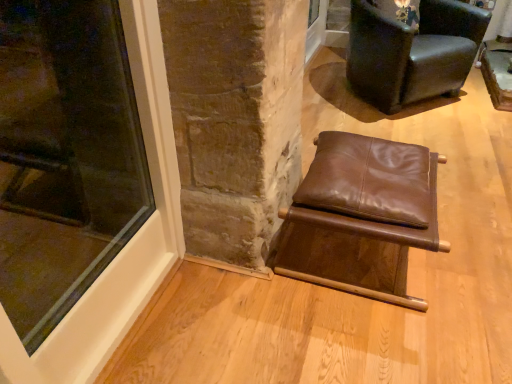
Question: Is transparent glass window at lower left not inside dark brown leather chair at upper right, placed as the first chair when sorted from back to front?

Choices:
 (A) no
 (B) yes

Answer: (B)

Question: Does transparent glass window at lower left appear on the right side of dark brown leather chair at upper right, placed as the first chair when sorted from back to front?

Choices:
 (A) yes
 (B) no

Answer: (B)

Question: Can you confirm if transparent glass window at lower left is wider than dark brown leather chair at upper right, positioned as the 2th chair in front-to-back order?

Choices:
 (A) yes
 (B) no

Answer: (B)

Question: From a real-world perspective, is transparent glass window at lower left physically above dark brown leather chair at upper right, the second chair when ordered from bottom to top?

Choices:
 (A) yes
 (B) no

Answer: (A)

Question: Is the depth of transparent glass window at lower left less than that of dark brown leather chair at upper right, the second chair when ordered from bottom to top?

Choices:
 (A) yes
 (B) no

Answer: (A)

Question: Is dark brown leather chair at upper right, which appears as the first chair when viewed from the top, bigger or smaller than transparent glass window at lower left?

Choices:
 (A) small
 (B) big

Answer: (B)

Question: Is dark brown leather chair at upper right, placed as the first chair when sorted from back to front, to the left or to the right of transparent glass window at lower left in the image?

Choices:
 (A) right
 (B) left

Answer: (A)

Question: Considering the positions of dark brown leather chair at upper right, placed as the first chair when sorted from back to front, and transparent glass window at lower left in the image, is dark brown leather chair at upper right, placed as the first chair when sorted from back to front, wider or thinner than transparent glass window at lower left?

Choices:
 (A) wide
 (B) thin

Answer: (A)

Question: Choose the correct answer: Is dark brown leather chair at upper right, placed as the first chair when sorted from back to front, inside transparent glass window at lower left or outside it?

Choices:
 (A) outside
 (B) inside

Answer: (A)

Question: From their relative heights in the image, would you say transparent glass window at lower left is taller or shorter than brown leather stool at center, the second chair from the top?

Choices:
 (A) tall
 (B) short

Answer: (A)

Question: Which is correct: transparent glass window at lower left is inside brown leather stool at center, marked as the 1th chair in a bottom-to-top arrangement, or outside of it?

Choices:
 (A) outside
 (B) inside

Answer: (A)

Question: From a real-world perspective, relative to brown leather stool at center, marked as the 2th chair in a back-to-front arrangement, is transparent glass window at lower left vertically above or below?

Choices:
 (A) below
 (B) above

Answer: (B)

Question: Relative to brown leather stool at center, the second chair from the top, is transparent glass window at lower left in front or behind?

Choices:
 (A) behind
 (B) front

Answer: (B)

Question: From their relative heights in the image, would you say brown leather stool at center, the second chair from the top, is taller or shorter than dark brown leather chair at upper right, the second chair when ordered from bottom to top?

Choices:
 (A) tall
 (B) short

Answer: (B)

Question: Which is correct: brown leather stool at center, marked as the 1th chair in a bottom-to-top arrangement, is inside dark brown leather chair at upper right, placed as the first chair when sorted from back to front, or outside of it?

Choices:
 (A) inside
 (B) outside

Answer: (B)